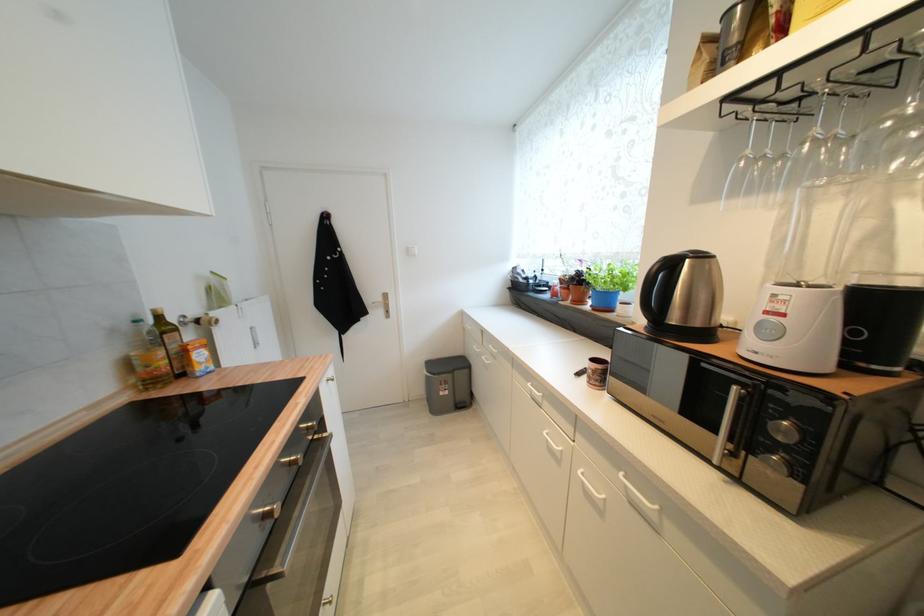
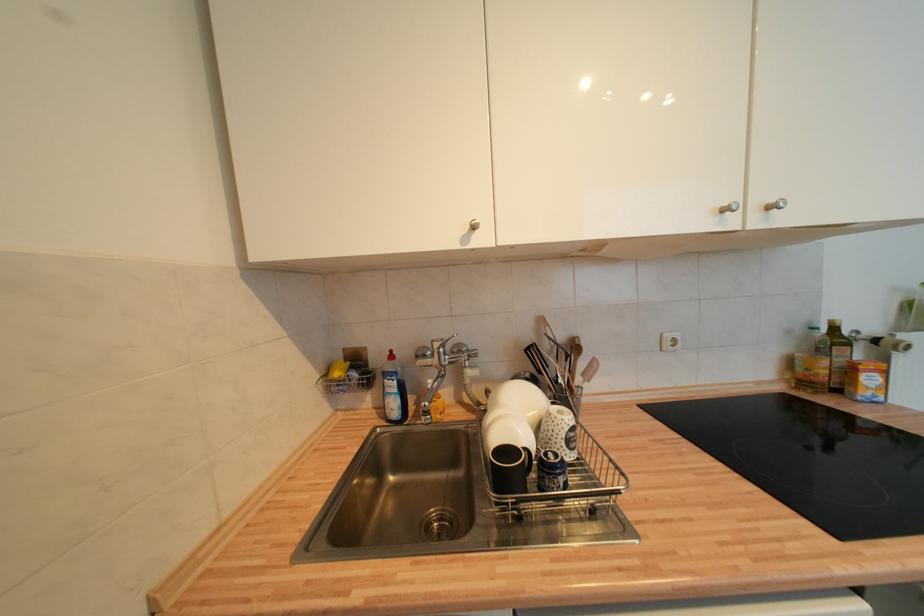
In the second image, find the point that corresponds to [164,320] in the first image.

(840, 331)